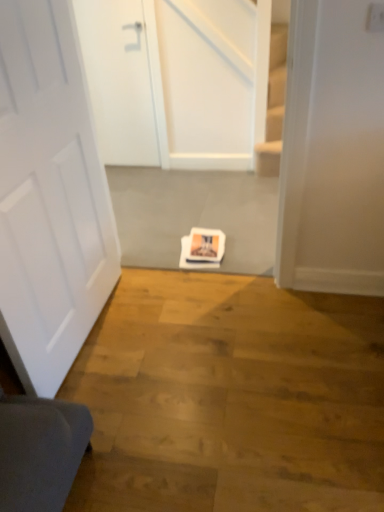
Describe the element at coordinates (119, 79) in the screenshot. This screenshot has height=512, width=384. I see `white matte door at upper left, arranged as the 2th door when ordered from the bottom` at that location.

Find the location of a particular element. white matte door at upper left, arranged as the 1th door when viewed from the back is located at coordinates (119, 79).

In the scene shown: Measure the distance between white matte door at center, the second door when ordered from back to front, and camera.

white matte door at center, the second door when ordered from back to front, and camera are 1.19 meters apart from each other.

Find the location of a particular element. This screenshot has height=512, width=384. white matte door at center, the second door when ordered from back to front is located at coordinates (49, 196).

What do you see at coordinates (49, 196) in the screenshot?
I see `white matte door at center, the 1th door viewed from the front` at bounding box center [49, 196].

This screenshot has height=512, width=384. I want to click on white matte door at upper left, the 2th door viewed from the front, so click(119, 79).

Visually, is white matte door at center, the second door when ordered from back to front, positioned to the left or to the right of white matte door at upper left, arranged as the 1th door when viewed from the back?

Based on their positions, white matte door at center, the second door when ordered from back to front, is located to the right of white matte door at upper left, arranged as the 1th door when viewed from the back.

Considering the positions of objects white matte door at center, the second door when ordered from back to front, and white matte door at upper left, which ranks as the first door in top-to-bottom order, in the image provided, who is behind, white matte door at center, the second door when ordered from back to front, or white matte door at upper left, which ranks as the first door in top-to-bottom order,?

white matte door at upper left, which ranks as the first door in top-to-bottom order, is further away from the camera.

Which is farther from the camera, (60, 249) or (119, 52)?

The point (119, 52) is farther.

From the image's perspective, is white matte door at center, arranged as the first door when ordered from the bottom, under white matte door at upper left, arranged as the 1th door when viewed from the back?

Yes.

From a real-world perspective, relative to white matte door at upper left, arranged as the 1th door when viewed from the back, is white matte door at center, arranged as the first door when ordered from the bottom, vertically above or below?

In terms of real-world spatial position, white matte door at center, arranged as the first door when ordered from the bottom, is above white matte door at upper left, arranged as the 1th door when viewed from the back.

Which of these two, white matte door at center, the second door when ordered from back to front, or white matte door at upper left, which ranks as the first door in top-to-bottom order, is thinner?

Thinner between the two is white matte door at center, the second door when ordered from back to front.

Considering the relative sizes of white matte door at center, the 1th door viewed from the front, and white matte door at upper left, arranged as the 2th door when ordered from the bottom, in the image provided, is white matte door at center, the 1th door viewed from the front, shorter than white matte door at upper left, arranged as the 2th door when ordered from the bottom,?

No.

Between white matte door at center, arranged as the first door when ordered from the bottom, and white matte door at upper left, arranged as the 2th door when ordered from the bottom, which one has larger size?

white matte door at center, arranged as the first door when ordered from the bottom.

Is white matte door at center, the second door when ordered from back to front, not within white matte door at upper left, which ranks as the first door in top-to-bottom order?

Indeed, white matte door at center, the second door when ordered from back to front, is completely outside white matte door at upper left, which ranks as the first door in top-to-bottom order.

Is white matte door at center, the 2th door from the top, not near white matte door at upper left, arranged as the 1th door when viewed from the back?

Yes, white matte door at center, the 2th door from the top, and white matte door at upper left, arranged as the 1th door when viewed from the back, are quite far apart.

Is white matte door at center, arranged as the first door when ordered from the bottom, turned away from white matte door at upper left, arranged as the 2th door when ordered from the bottom?

white matte door at center, arranged as the first door when ordered from the bottom, does not have its back to white matte door at upper left, arranged as the 2th door when ordered from the bottom.

How different are the orientations of white matte door at center, arranged as the first door when ordered from the bottom, and white matte door at upper left, arranged as the 1th door when viewed from the back, in degrees?

The facing directions of white matte door at center, arranged as the first door when ordered from the bottom, and white matte door at upper left, arranged as the 1th door when viewed from the back, are 89 degrees apart.

How distant is white matte door at center, arranged as the first door when ordered from the bottom, from white matte door at upper left, arranged as the 2th door when ordered from the bottom?

They are 5.16 feet apart.

Find the location of `door located below the white matte door at upper left, arranged as the 2th door when ordered from the bottom (from the image's perspective)`. door located below the white matte door at upper left, arranged as the 2th door when ordered from the bottom (from the image's perspective) is located at coordinates (49, 196).

From the picture: Visually, is white matte door at upper left, arranged as the 1th door when viewed from the back, positioned to the left or to the right of white matte door at center, the second door when ordered from back to front?

white matte door at upper left, arranged as the 1th door when viewed from the back, is positioned on white matte door at center, the second door when ordered from back to front,'s left side.

Which object is closer to the camera, white matte door at upper left, arranged as the 1th door when viewed from the back, or white matte door at center, the 2th door from the top?

white matte door at center, the 2th door from the top.

Does point (99, 26) come farther from viewer compared to point (96, 182)?

That is True.

Based on the photo, from the image's perspective, which object appears higher, white matte door at upper left, which ranks as the first door in top-to-bottom order, or white matte door at center, the second door when ordered from back to front?

white matte door at upper left, which ranks as the first door in top-to-bottom order, appears higher in the image.

From a real-world perspective, is white matte door at upper left, arranged as the 1th door when viewed from the back, positioned above or below white matte door at center, the 2th door from the top?

white matte door at upper left, arranged as the 1th door when viewed from the back, is situated lower than white matte door at center, the 2th door from the top, in the real world.

Considering the sizes of white matte door at upper left, arranged as the 1th door when viewed from the back, and white matte door at center, arranged as the first door when ordered from the bottom, in the image, is white matte door at upper left, arranged as the 1th door when viewed from the back, wider or thinner than white matte door at center, arranged as the first door when ordered from the bottom,?

white matte door at upper left, arranged as the 1th door when viewed from the back, is wider than white matte door at center, arranged as the first door when ordered from the bottom.

Considering the relative sizes of white matte door at upper left, the 2th door viewed from the front, and white matte door at center, arranged as the first door when ordered from the bottom, in the image provided, is white matte door at upper left, the 2th door viewed from the front, taller than white matte door at center, arranged as the first door when ordered from the bottom,?

No.

Considering the sizes of objects white matte door at upper left, which ranks as the first door in top-to-bottom order, and white matte door at center, the 2th door from the top, in the image provided, who is bigger, white matte door at upper left, which ranks as the first door in top-to-bottom order, or white matte door at center, the 2th door from the top,?

With larger size is white matte door at center, the 2th door from the top.

Choose the correct answer: Is white matte door at upper left, the 2th door viewed from the front, inside white matte door at center, arranged as the first door when ordered from the bottom, or outside it?

white matte door at upper left, the 2th door viewed from the front, exists outside the volume of white matte door at center, arranged as the first door when ordered from the bottom.

Is white matte door at upper left, which ranks as the first door in top-to-bottom order, with white matte door at center, the 1th door viewed from the front?

They are not placed beside each other.

Is white matte door at upper left, arranged as the 2th door when ordered from the bottom, oriented towards white matte door at center, the second door when ordered from back to front?

Yes, white matte door at upper left, arranged as the 2th door when ordered from the bottom, is facing white matte door at center, the second door when ordered from back to front.

You are a GUI agent. You are given a task and a screenshot of the screen. Output one action in this format:
    pyautogui.click(x=<x>, y=<y>)
    Task: Click on the door that is above the white matte door at upper left, which ranks as the first door in top-to-bottom order (from a real-world perspective)
    
    Given the screenshot: What is the action you would take?
    pyautogui.click(x=49, y=196)

At what (x,y) coordinates should I click in order to perform the action: click on door that appears in front of the white matte door at upper left, arranged as the 1th door when viewed from the back. Please return your answer as a coordinate pair (x, y). Looking at the image, I should click on (49, 196).

Where is `door located on the right of white matte door at upper left, arranged as the 1th door when viewed from the back`? door located on the right of white matte door at upper left, arranged as the 1th door when viewed from the back is located at coordinates (49, 196).